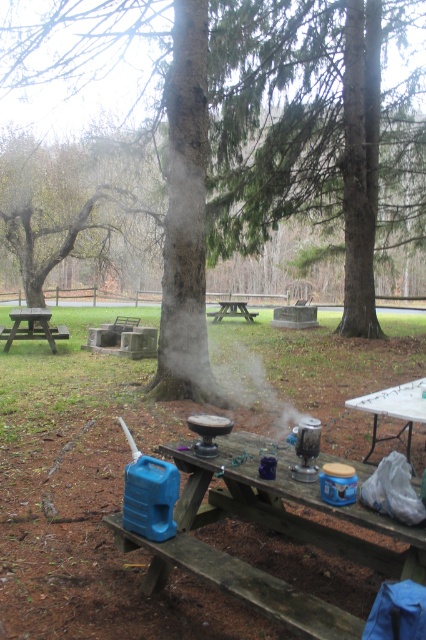
Question: Based on their relative distances, which object is nearer to the smooth bark tree at upper left?

Choices:
 (A) wooden picnic table at left
 (B) green rough bark tree at center
 (C) white plastic table at center

Answer: (B)

Question: Does wooden picnic table at left lie behind brown wooden picnic table at center?

Choices:
 (A) yes
 (B) no

Answer: (B)

Question: Where is green rough bark tree at center located in relation to white plastic table at center in the image?

Choices:
 (A) right
 (B) left

Answer: (B)

Question: Which of the following is the farthest from the observer?

Choices:
 (A) (40, 326)
 (B) (121, 257)
 (C) (227, 308)

Answer: (B)

Question: Can you confirm if white plastic table at center is positioned to the right of wooden picnic table at left?

Choices:
 (A) yes
 (B) no

Answer: (A)

Question: Among these points, which one is farthest from the camera?

Choices:
 (A) (377, 392)
 (B) (51, 328)
 (C) (216, 317)

Answer: (C)